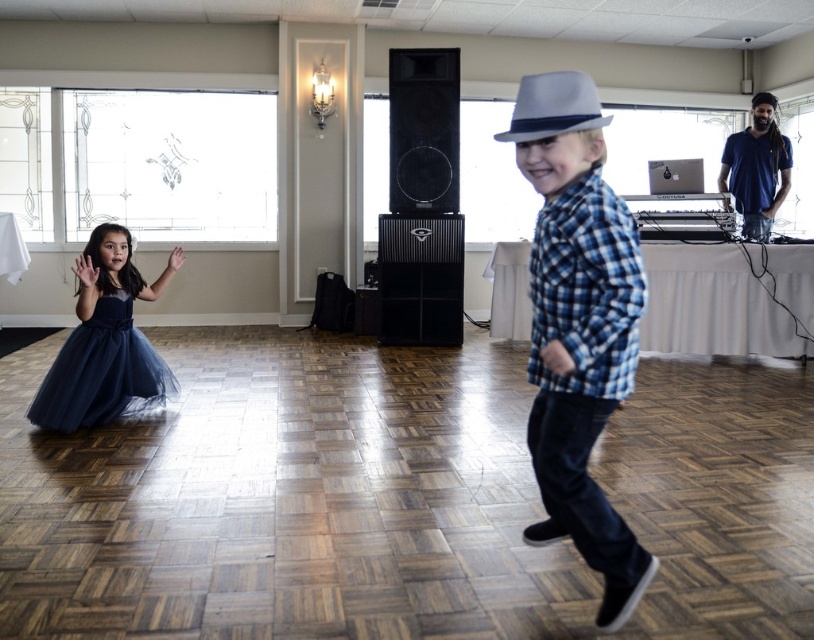
Question: Does navy tulle dress at lower left lie behind gray felt fedora at upper center?

Choices:
 (A) no
 (B) yes

Answer: (B)

Question: Which point is closer to the camera taking this photo?

Choices:
 (A) (537, 104)
 (B) (594, 156)
 (C) (125, 324)

Answer: (A)

Question: Is blue plaid shirt at center below navy tulle dress at lower left?

Choices:
 (A) no
 (B) yes

Answer: (A)

Question: Does navy tulle dress at lower left come in front of gray felt fedora at upper center?

Choices:
 (A) no
 (B) yes

Answer: (A)

Question: Which object is positioned closest to the navy tulle dress at lower left?

Choices:
 (A) gray felt fedora at upper center
 (B) blue plaid shirt at center

Answer: (B)

Question: Among these points, which one is nearest to the camera?

Choices:
 (A) (526, 77)
 (B) (545, 116)

Answer: (B)